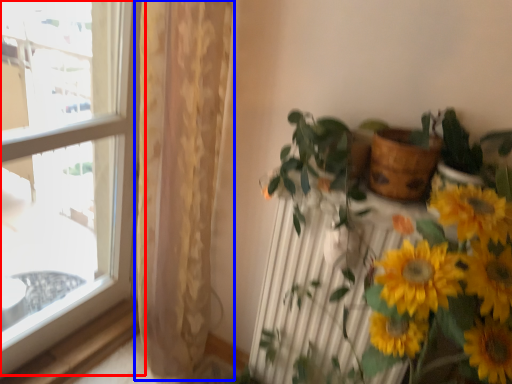
Question: Which point is closer to the camera, window (highlighted by a red box) or curtain (highlighted by a blue box)?

Choices:
 (A) window
 (B) curtain

Answer: (A)